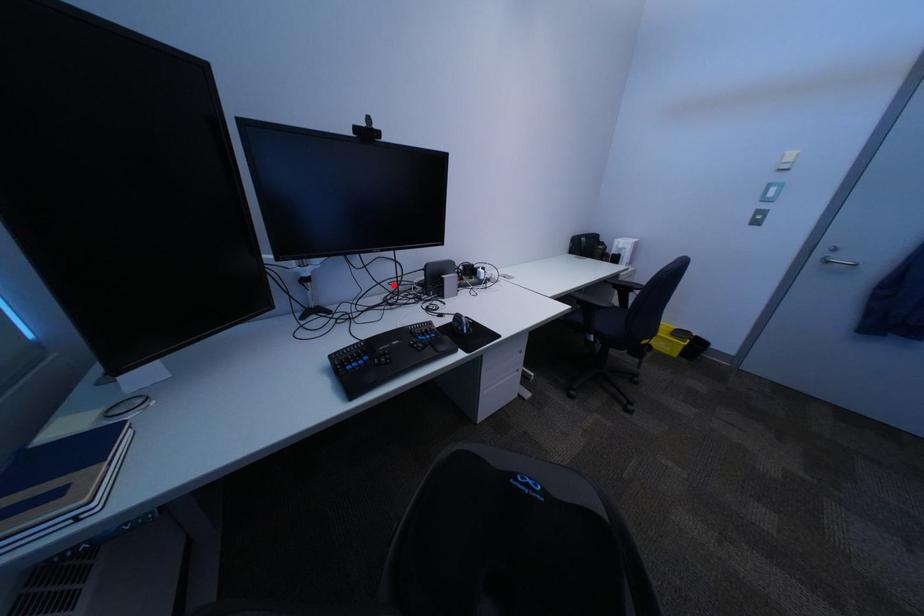
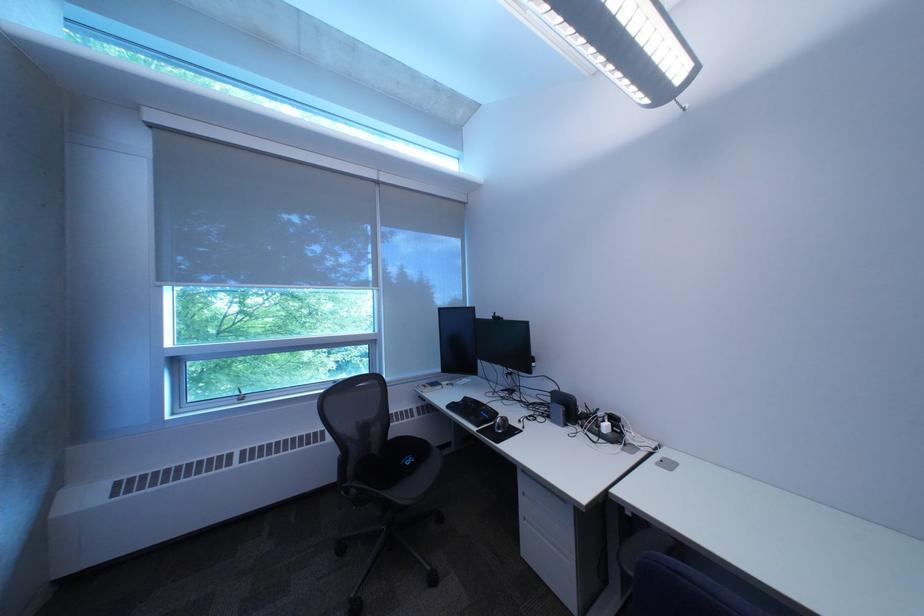
Question: I am providing you with two images of the same scene from different viewpoints. Given a red point in image1, look at the same physical point in image2. Is it:

Choices:
 (A) Closer to the viewpoint
 (B) Farther from the viewpoint

Answer: (B)